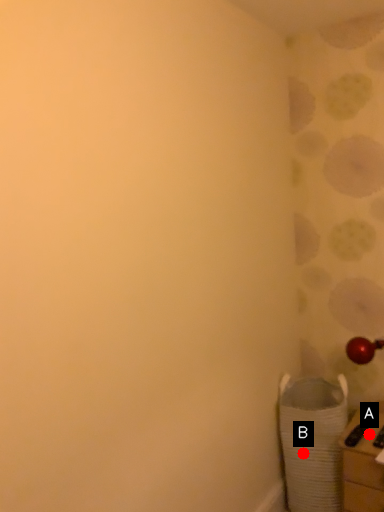
Question: Two points are circled on the image, labeled by A and B beside each circle. Among these points, which one is farthest from the camera?

Choices:
 (A) A is further
 (B) B is further

Answer: (B)